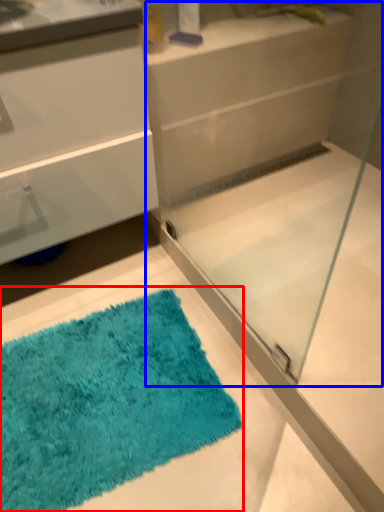
Question: Which object appears farthest to the camera in this image, bath mat (highlighted by a red box) or glass box (highlighted by a blue box)?

Choices:
 (A) bath mat
 (B) glass box

Answer: (A)